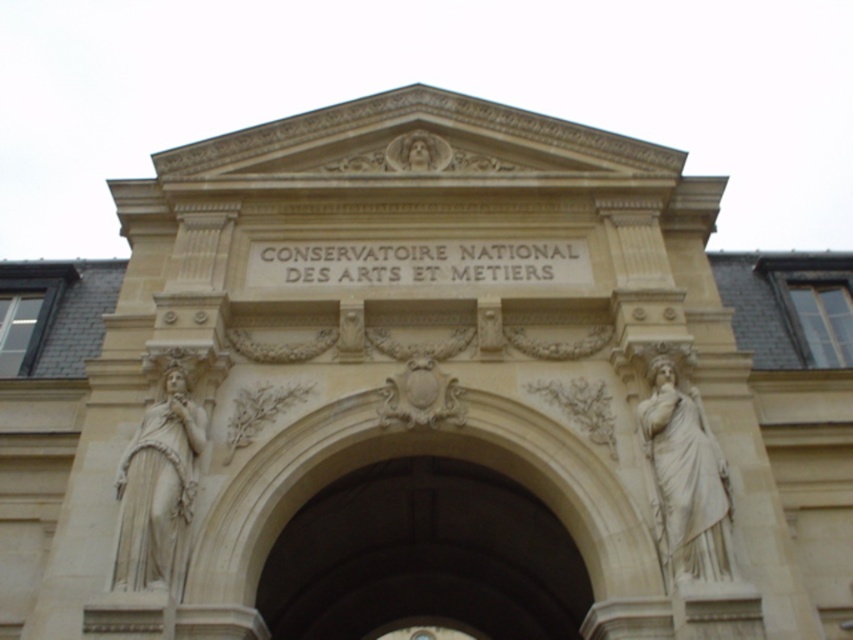
You are standing at the entrance of the Conservatoire National des Arts et M. Please write a question about the white marble statue at right based on the provided information. Ensure the question adheres to the rules outlined above. 1. The question must mention the object label exactly as given in the Objects section. 2. Do not include any information from the Objects Description in the question. 3. The question should be framed from an observer standing at the entrance. 4. The question should ask about a

The white marble statue at right is positioned at point (683,480), which is in the lower right quadrant of the entrance facade. This means it is closer to the bottom right corner of the entrance area. Since the statue is placed at this coordinate, it would be situated near the lower right section of the building facade, making it easily visible to someone approaching the entrance from the front. The coordinates indicate it is not centered but rather shifted towards the right side, so visitors would see a

You are an art student visiting the Conservatoire National des Arts et M. You want to take a photo of both the white marble statue at right and the white stone statue at left. However, you can only position yourself in a spot where you can see both statues clearly. Based on their arrangement, where should you stand relative to the statues to ensure both are visible in your photo?

You should stand in front of the white marble statue at right, as the white stone statue at left is behind it, so positioning yourself in front of the marble statue will allow you to see both statues simultaneously.